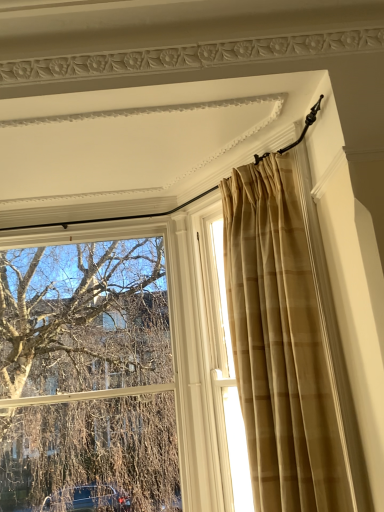
Question: Would you say beige textured curtain at right, the 2th window viewed from the left, is outside clear glass window at upper left, placed as the first window when sorted from left to right?

Choices:
 (A) no
 (B) yes

Answer: (B)

Question: Can you confirm if beige textured curtain at right, the 2th window viewed from the left, is wider than clear glass window at upper left, the second window when ordered from right to left?

Choices:
 (A) yes
 (B) no

Answer: (B)

Question: From a real-world perspective, does beige textured curtain at right, the 2th window viewed from the left, sit lower than clear glass window at upper left, placed as the first window when sorted from left to right?

Choices:
 (A) no
 (B) yes

Answer: (A)

Question: Is clear glass window at upper left, placed as the first window when sorted from left to right, completely or partially inside beige textured curtain at right, which is counted as the first window, starting from the right?

Choices:
 (A) yes
 (B) no

Answer: (B)

Question: Does beige textured curtain at right, the 2th window viewed from the left, appear on the right side of clear glass window at upper left, the second window when ordered from right to left?

Choices:
 (A) yes
 (B) no

Answer: (A)

Question: Looking at their shapes, would you say beige textured curtain at right, the 2th window viewed from the left, is wider or thinner than clear glass window at upper left, the second window when ordered from right to left?

Choices:
 (A) wide
 (B) thin

Answer: (B)

Question: Based on their positions, is beige textured curtain at right, which is counted as the first window, starting from the right, located to the left or right of clear glass window at upper left, placed as the first window when sorted from left to right?

Choices:
 (A) right
 (B) left

Answer: (A)

Question: From a real-world perspective, is beige textured curtain at right, which is counted as the first window, starting from the right, physically located above or below clear glass window at upper left, the second window when ordered from right to left?

Choices:
 (A) above
 (B) below

Answer: (A)

Question: Is beige textured curtain at right, which is counted as the first window, starting from the right, in front of or behind clear glass window at upper left, placed as the first window when sorted from left to right, in the image?

Choices:
 (A) behind
 (B) front

Answer: (B)

Question: Is beige plaid curtain at upper right to the left or to the right of clear glass window at upper left, placed as the first window when sorted from left to right, in the image?

Choices:
 (A) right
 (B) left

Answer: (A)

Question: From the image's perspective, is beige plaid curtain at upper right positioned above or below clear glass window at upper left, placed as the first window when sorted from left to right?

Choices:
 (A) above
 (B) below

Answer: (A)

Question: Is beige plaid curtain at upper right situated inside clear glass window at upper left, placed as the first window when sorted from left to right, or outside?

Choices:
 (A) outside
 (B) inside

Answer: (A)

Question: In terms of size, does beige plaid curtain at upper right appear bigger or smaller than clear glass window at upper left, placed as the first window when sorted from left to right?

Choices:
 (A) big
 (B) small

Answer: (A)

Question: Is point (36, 417) closer or farther from the camera than point (307, 254)?

Choices:
 (A) farther
 (B) closer

Answer: (A)

Question: Relative to beige plaid curtain at upper right, is clear glass window at upper left, the second window when ordered from right to left, in front or behind?

Choices:
 (A) front
 (B) behind

Answer: (B)